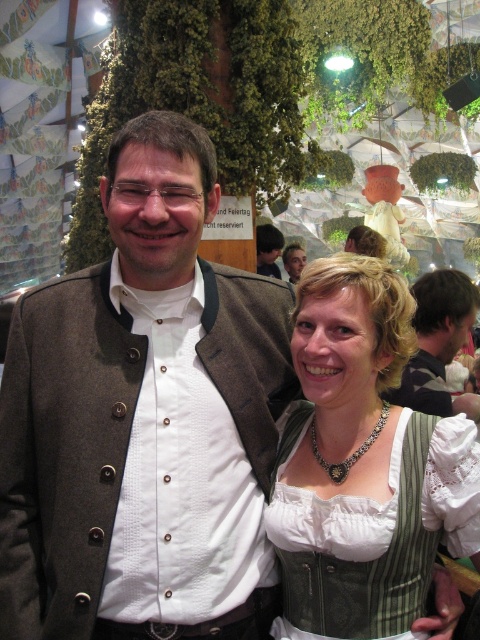
You are a photographer standing at the back of the room. You want to take a photo of the green plaid dirndl at center and the matte brown jacket at center so that both are in focus. The camera you are using has a depth of field that can cover 5 meters. Will both subjects be in focus?

The green plaid dirndl at center and the matte brown jacket at center are 5.21 meters apart. Since the depth of field can only cover 5 meters, the distance between them exceeds the camera setting, so both subjects cannot be in focus simultaneously.

You are a photographer standing in front of the two people in the scene. You want to take a picture of both the green plaid dirndl at center and the brown wool jacket at center without cropping either of them. What is the minimum distance you should maintain between the camera and the subjects to ensure both are fully visible in the frame?

The minimum distance required is 16 inches because the green plaid dirndl at center and the brown wool jacket at center are 15.95 inches apart, so maintaining a distance of at least 16 inches ensures both are fully visible in the frame without cropping.